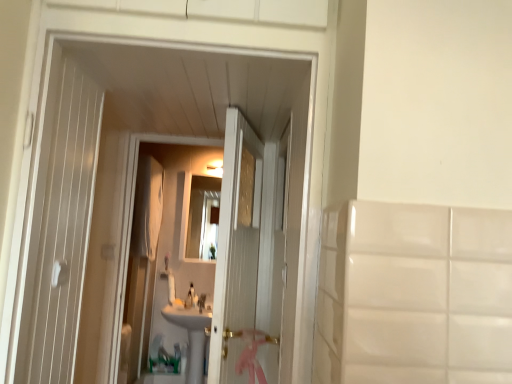
What do you see at coordinates (191, 297) in the screenshot? The image size is (512, 384). I see `white glossy faucet at center, marked as the first faucet in a left-to-right arrangement` at bounding box center [191, 297].

The height and width of the screenshot is (384, 512). Find the location of `white glossy soap at center`. white glossy soap at center is located at coordinates (178, 302).

Locate an element on the screen. This screenshot has height=384, width=512. white fabric screen door at left is located at coordinates (141, 267).

At what (x,y) coordinates should I click in order to perform the action: click on white glossy mirror at center. Please return your answer as a coordinate pair (x, y). The width and height of the screenshot is (512, 384). Looking at the image, I should click on 203,217.

I want to click on white glossy faucet at center, which is the second faucet in right-to-left order, so click(x=191, y=297).

Is white wooden door at center at the left side of white glossy faucet at center, placed as the 1th faucet when sorted from right to left?

In fact, white wooden door at center is to the right of white glossy faucet at center, placed as the 1th faucet when sorted from right to left.

In the scene shown: Is white wooden door at center spatially inside white glossy faucet at center, placed as the 2th faucet when sorted from left to right, or outside of it?

white wooden door at center is spatially situated outside white glossy faucet at center, placed as the 2th faucet when sorted from left to right.

From a real-world perspective, is white wooden door at center above or below white glossy faucet at center, placed as the 2th faucet when sorted from left to right?

white wooden door at center is above white glossy faucet at center, placed as the 2th faucet when sorted from left to right.

Between white wooden door at center and white glossy faucet at center, placed as the 1th faucet when sorted from right to left, which one has larger width?

white wooden door at center is wider.

From a real-world perspective, which is physically above, white glossy sink at center or white wooden door at center?

white wooden door at center.

Is white glossy sink at center positioned with its back to white wooden door at center?

No, white glossy sink at center is not facing the opposite direction of white wooden door at center.

Which is behind, point (176, 314) or point (231, 247)?

Point (176, 314)

Does white glossy sink at center have a lesser width compared to white wooden door at center?

Incorrect, the width of white glossy sink at center is not less than that of white wooden door at center.

Which object is further away from the camera taking this photo, white fabric screen door at left or white glossy mirror at center?

white glossy mirror at center is further away from the camera.

Which of these two, white fabric screen door at left or white glossy mirror at center, is thinner?

With smaller width is white glossy mirror at center.

Is white fabric screen door at left taller than white glossy mirror at center?

Yes, white fabric screen door at left is taller than white glossy mirror at center.

How different are the orientations of white fabric screen door at left and white glossy mirror at center in degrees?

The angle between the facing direction of white fabric screen door at left and the facing direction of white glossy mirror at center is 88.8 degrees.

Consider the image. Is white glossy soap at center not within white fabric screen door at left?

Yes, white glossy soap at center is outside of white fabric screen door at left.

Is white glossy soap at center wider or thinner than white fabric screen door at left?

white glossy soap at center is wider than white fabric screen door at left.

Is point (177, 304) closer or farther from the camera than point (137, 208)?

Point (177, 304).

Is white glossy soap at center facing away from white glossy mirror at center?

No, white glossy mirror at center is not at the back of white glossy soap at center.

Which object is positioned more to the right, white glossy soap at center or white glossy mirror at center?

white glossy mirror at center is more to the right.

Does white glossy soap at center have a larger size compared to white glossy mirror at center?

No, white glossy soap at center is not bigger than white glossy mirror at center.

In terms of height, does white glossy soap at center look taller or shorter compared to white glossy sink at center?

Clearly, white glossy soap at center is shorter compared to white glossy sink at center.

Would you say white glossy soap at center is a long distance from white glossy sink at center?

No, there isn't a large distance between white glossy soap at center and white glossy sink at center.

Considering the relative sizes of white glossy soap at center and white glossy sink at center in the image provided, is white glossy soap at center thinner than white glossy sink at center?

Correct, the width of white glossy soap at center is less than that of white glossy sink at center.

Can you confirm if white glossy soap at center is smaller than white glossy faucet at center, which is the second faucet in right-to-left order?

Indeed, white glossy soap at center has a smaller size compared to white glossy faucet at center, which is the second faucet in right-to-left order.

Considering the positions of point (182, 302) and point (192, 285), is point (182, 302) closer or farther from the camera than point (192, 285)?

Point (182, 302) is positioned closer to the camera compared to point (192, 285).

From the picture: Which is more to the left, white glossy soap at center or white glossy faucet at center, which is the second faucet in right-to-left order?

white glossy soap at center.

Is white glossy soap at center touching white glossy faucet at center, marked as the first faucet in a left-to-right arrangement?

No.

In order to click on door to the right of white glossy faucet at center, placed as the 2th faucet when sorted from left to right in this screenshot , I will do `click(236, 250)`.

I want to click on sink below the white wooden door at center (from the image's perspective), so click(189, 332).

Looking at the image, which one is located closer to white fabric screen door at left, white glossy faucet at center, placed as the 2th faucet when sorted from left to right, or white glossy sink at center?

Among the two, white glossy sink at center is located nearer to white fabric screen door at left.

Based on their spatial positions, is white fabric screen door at left or white glossy faucet at center, marked as the first faucet in a left-to-right arrangement, further from white glossy soap at center?

The object further to white glossy soap at center is white fabric screen door at left.

From the image, which object appears to be farther from white fabric screen door at left, white glossy sink at center or white glossy faucet at center, placed as the 2th faucet when sorted from left to right?

The object further to white fabric screen door at left is white glossy faucet at center, placed as the 2th faucet when sorted from left to right.

Looking at this image, based on their spatial positions, is white wooden door at center or white glossy sink at center further from white glossy mirror at center?

white wooden door at center is further to white glossy mirror at center.

Based on their spatial positions, is white glossy mirror at center or white wooden door at center further from white glossy faucet at center, placed as the 1th faucet when sorted from right to left?

Based on the image, white wooden door at center appears to be further to white glossy faucet at center, placed as the 1th faucet when sorted from right to left.

From the picture: From the image, which object appears to be nearer to white fabric screen door at left, white glossy sink at center or white glossy mirror at center?

white glossy sink at center lies closer to white fabric screen door at left than the other object.

When comparing their distances from white glossy sink at center, does white wooden door at center or white glossy faucet at center, which is the second faucet in right-to-left order, seem closer?

white glossy faucet at center, which is the second faucet in right-to-left order, lies closer to white glossy sink at center than the other object.

When comparing their distances from white glossy mirror at center, does white fabric screen door at left or white glossy faucet at center, marked as the first faucet in a left-to-right arrangement, seem further?

Among the two, white glossy faucet at center, marked as the first faucet in a left-to-right arrangement, is located further to white glossy mirror at center.

Find the location of `faucet between white glossy soap at center and white glossy faucet at center, placed as the 1th faucet when sorted from right to left, in the horizontal direction`. faucet between white glossy soap at center and white glossy faucet at center, placed as the 1th faucet when sorted from right to left, in the horizontal direction is located at coordinates (191, 297).

At what (x,y) coordinates should I click in order to perform the action: click on screen door between white wooden door at center and white glossy faucet at center, placed as the 2th faucet when sorted from left to right, from front to back. Please return your answer as a coordinate pair (x, y). Image resolution: width=512 pixels, height=384 pixels. Looking at the image, I should click on (141, 267).

Locate an element on the screen. The height and width of the screenshot is (384, 512). soap between white fabric screen door at left and white glossy mirror at center along the z-axis is located at coordinates (178, 302).

Where is `soap between white glossy mirror at center and white glossy sink at center in the vertical direction`? The height and width of the screenshot is (384, 512). soap between white glossy mirror at center and white glossy sink at center in the vertical direction is located at coordinates (178, 302).